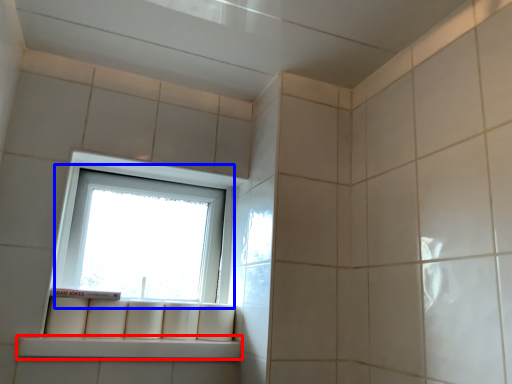
Question: Which of the following is the farthest to the observer, window sill (highlighted by a red box) or window (highlighted by a blue box)?

Choices:
 (A) window sill
 (B) window

Answer: (B)